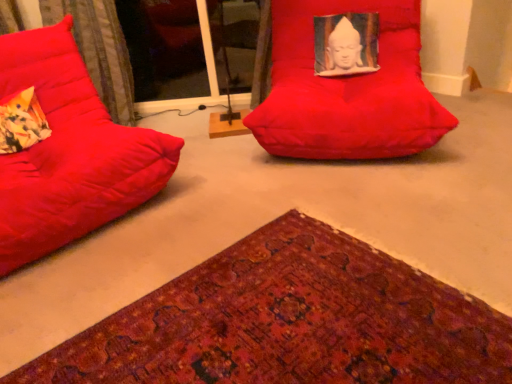
This screenshot has height=384, width=512. Find the location of `free area in between matte red bean bag at left, the 2th furniture when ordered from right to left, and textured woolen mat at lower left`. free area in between matte red bean bag at left, the 2th furniture when ordered from right to left, and textured woolen mat at lower left is located at coordinates (141, 255).